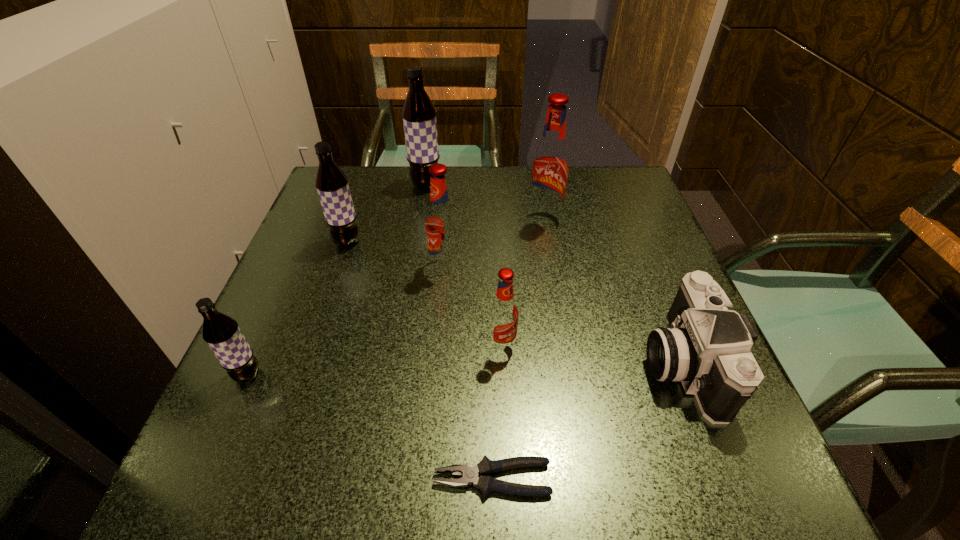
This screenshot has height=540, width=960. I want to click on the nearest root beer, so click(222, 334).

Where is `the leftmost root beer`? the leftmost root beer is located at coordinates (x=222, y=334).

Locate an element on the screen. This screenshot has height=540, width=960. the rightmost object is located at coordinates (707, 347).

Where is `the second shortest object`? the second shortest object is located at coordinates (707, 347).

Locate an element on the screen. The image size is (960, 540). gray pliers is located at coordinates (486, 484).

Find the location of a particular element. The width and height of the screenshot is (960, 540). the shortest object is located at coordinates (486, 484).

Find the location of a particular element. The image size is (960, 540). blank space located 0.100m on the front of the fifth nearest root beer is located at coordinates (551, 259).

The width and height of the screenshot is (960, 540). Identify the location of free space located 0.380m on the front of the rightmost brown root beer. (407, 301).

Identify the location of vacant space located on the left of the second biggest red root beer. The image size is (960, 540). (373, 266).

Identify the location of vacant space positioned on the right of the fourth nearest root beer. This screenshot has width=960, height=540. (533, 242).